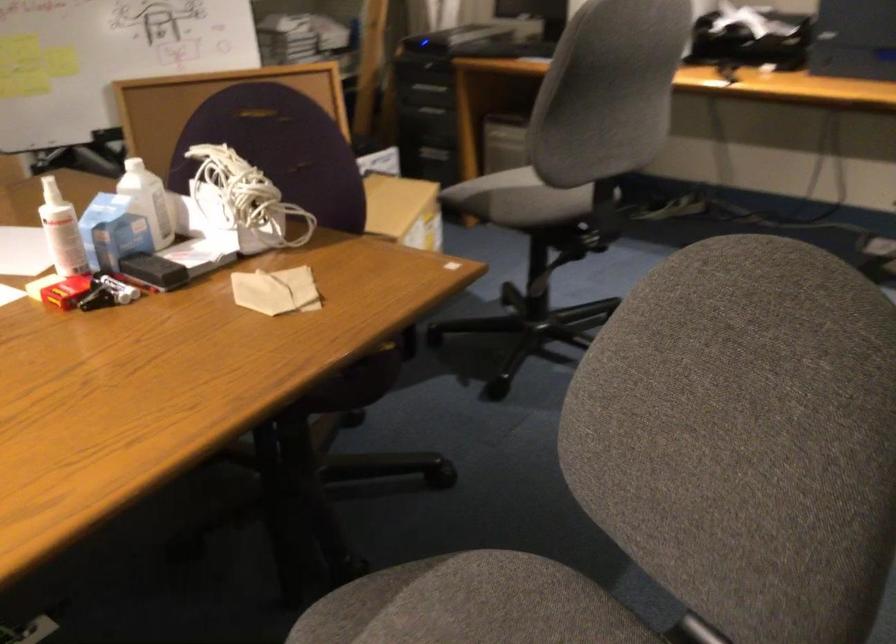
Image resolution: width=896 pixels, height=644 pixels. What do you see at coordinates (519, 196) in the screenshot?
I see `a gray chair sitting surface` at bounding box center [519, 196].